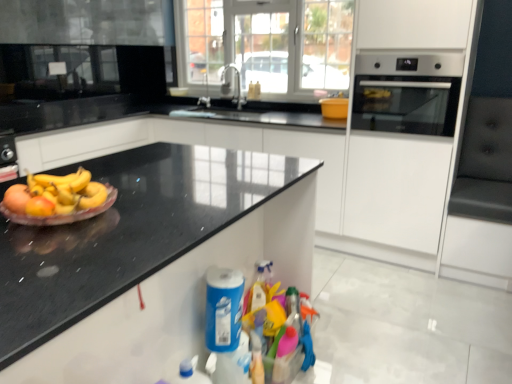
Question: Can you confirm if silver metallic faucet at upper center is thinner than satin silver oven at right?

Choices:
 (A) no
 (B) yes

Answer: (B)

Question: Is silver metallic faucet at upper center located outside satin silver oven at right?

Choices:
 (A) yes
 (B) no

Answer: (A)

Question: Considering the relative sizes of silver metallic faucet at upper center and satin silver oven at right in the image provided, is silver metallic faucet at upper center wider than satin silver oven at right?

Choices:
 (A) no
 (B) yes

Answer: (A)

Question: Can you confirm if silver metallic faucet at upper center is positioned to the left of satin silver oven at right?

Choices:
 (A) no
 (B) yes

Answer: (B)

Question: Does silver metallic faucet at upper center have a lesser height compared to satin silver oven at right?

Choices:
 (A) yes
 (B) no

Answer: (A)

Question: Could you tell me if silver metallic faucet at upper center is facing satin silver oven at right?

Choices:
 (A) no
 (B) yes

Answer: (A)

Question: Could you tell me if satin nickel faucet at center is facing blue plastic cleaning product at lower center?

Choices:
 (A) yes
 (B) no

Answer: (B)

Question: From the image's perspective, is satin nickel faucet at center over blue plastic cleaning product at lower center?

Choices:
 (A) no
 (B) yes

Answer: (B)

Question: Would you say satin nickel faucet at center is a long distance from blue plastic cleaning product at lower center?

Choices:
 (A) no
 (B) yes

Answer: (B)

Question: Can you confirm if satin nickel faucet at center is bigger than blue plastic cleaning product at lower center?

Choices:
 (A) yes
 (B) no

Answer: (A)

Question: Would you say satin nickel faucet at center contains blue plastic cleaning product at lower center?

Choices:
 (A) yes
 (B) no

Answer: (B)

Question: Does satin nickel faucet at center have a greater width compared to blue plastic cleaning product at lower center?

Choices:
 (A) no
 (B) yes

Answer: (B)

Question: Would you consider blue plastic cleaning product at lower center to be distant from satin nickel faucet at center?

Choices:
 (A) no
 (B) yes

Answer: (B)